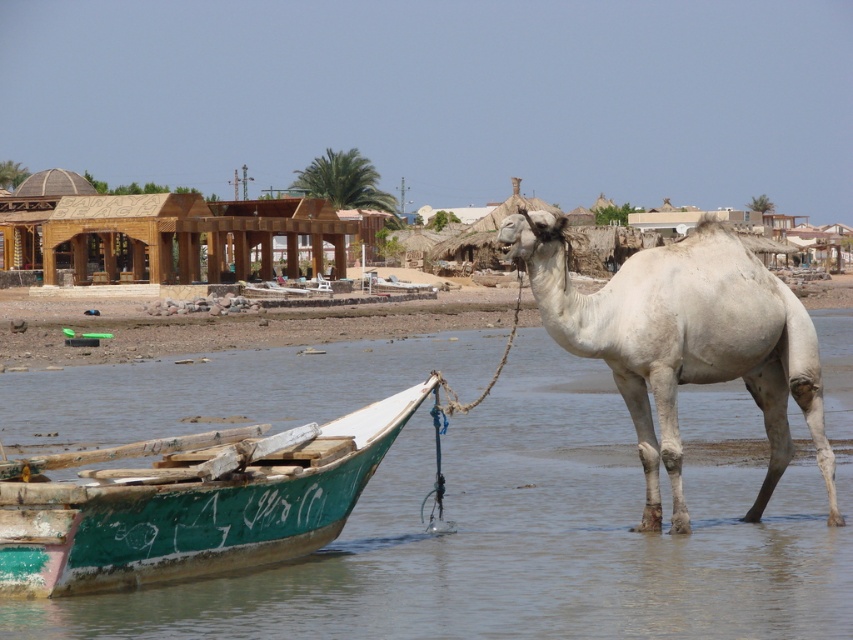
Question: Which of the following is the farthest from the observer?

Choices:
 (A) white matte camel at center
 (B) clear water at boat right
 (C) green painted wood boat at lower left

Answer: (A)

Question: Does clear water at boat right appear under green painted wood boat at lower left?

Choices:
 (A) yes
 (B) no

Answer: (B)

Question: Can you confirm if clear water at boat right is positioned to the right of green painted wood boat at lower left?

Choices:
 (A) yes
 (B) no

Answer: (A)

Question: Which of these objects is positioned closest to the white matte camel at center?

Choices:
 (A) clear water at boat right
 (B) green painted wood boat at lower left

Answer: (B)

Question: Is green painted wood boat at lower left below white matte camel at center?

Choices:
 (A) yes
 (B) no

Answer: (A)

Question: Which of the following is the farthest from the observer?

Choices:
 (A) clear water at boat right
 (B) green painted wood boat at lower left
 (C) white matte camel at center

Answer: (C)